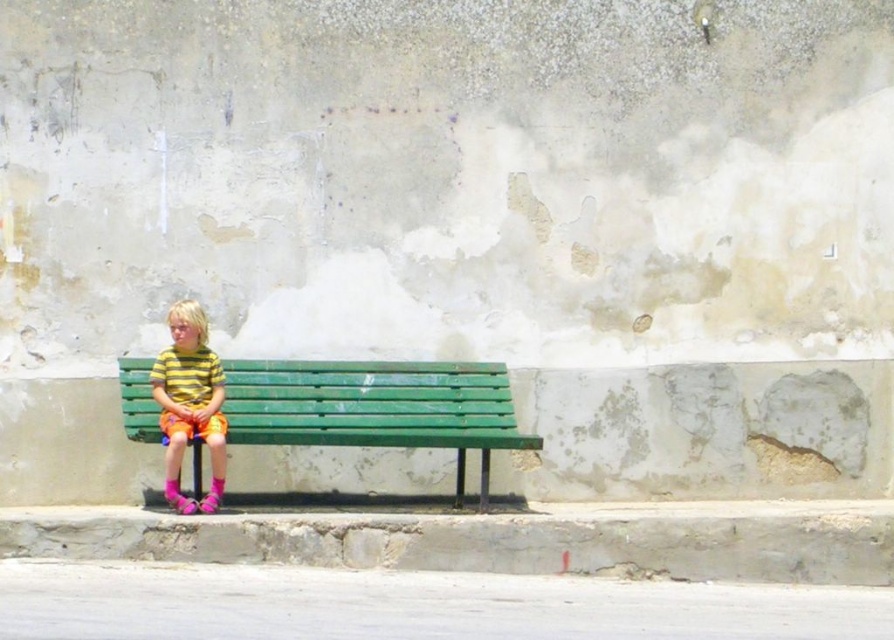
Does green painted wood bench at center have a lesser width compared to striped cotton shirt at center?

In fact, green painted wood bench at center might be wider than striped cotton shirt at center.

Does green painted wood bench at center appear on the left side of striped cotton shirt at center?

No, green painted wood bench at center is not to the left of striped cotton shirt at center.

Image resolution: width=894 pixels, height=640 pixels. What are the coordinates of `green painted wood bench at center` in the screenshot? It's located at (377, 406).

Locate an element on the screen. Image resolution: width=894 pixels, height=640 pixels. green painted wood bench at center is located at coordinates (377, 406).